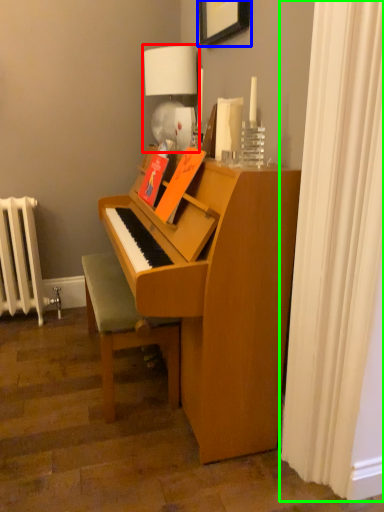
Question: Which object is the farthest from table lamp (highlighted by a red box)? Choose among these: picture frame (highlighted by a blue box) or shower curtain (highlighted by a green box).

Choices:
 (A) picture frame
 (B) shower curtain

Answer: (B)